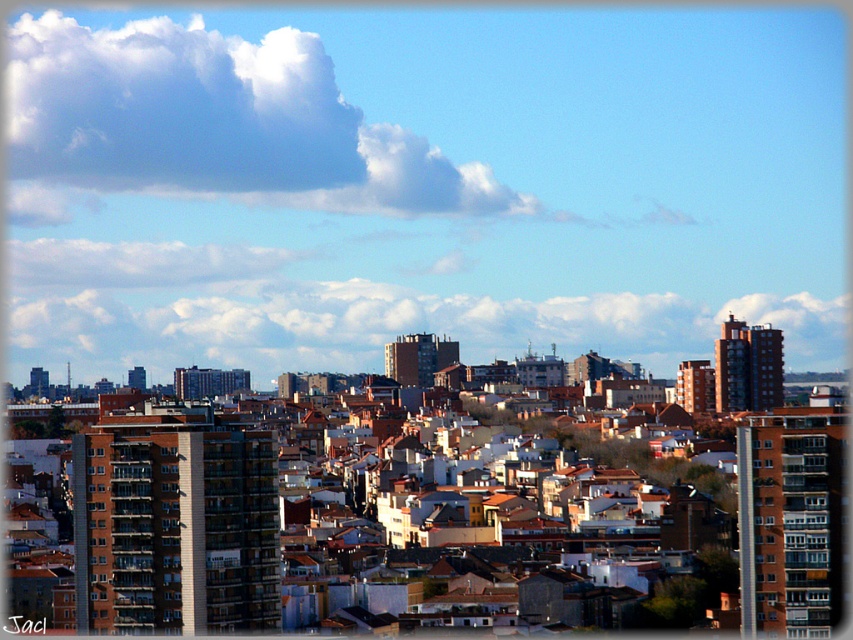
You are an architect analyzing this cityscape. You notice the matte concrete buildings at center and the white fluffy cloud at upper center. Based on their positions in the image, which object is closer to the observer?

The matte concrete buildings at center are closer to the observer because they are positioned in front of the white fluffy cloud at upper center.

You are an architect designing a new building and want to ensure it fits well with the existing cityscape. Given the matte concrete buildings at center and the white fluffy cloud at upper center, which object should you consider in terms of width to maintain proportion?

You should consider the matte concrete buildings at center because they are likely wider than the white fluffy cloud at upper center, ensuring the new building aligns with the scale of the existing structures.